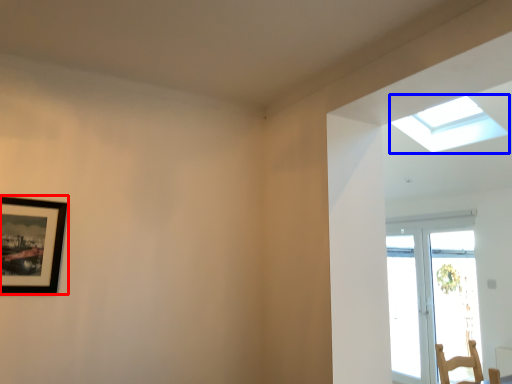
Question: Which object is closer to the camera taking this photo, picture frame (highlighted by a red box) or window (highlighted by a blue box)?

Choices:
 (A) picture frame
 (B) window

Answer: (A)